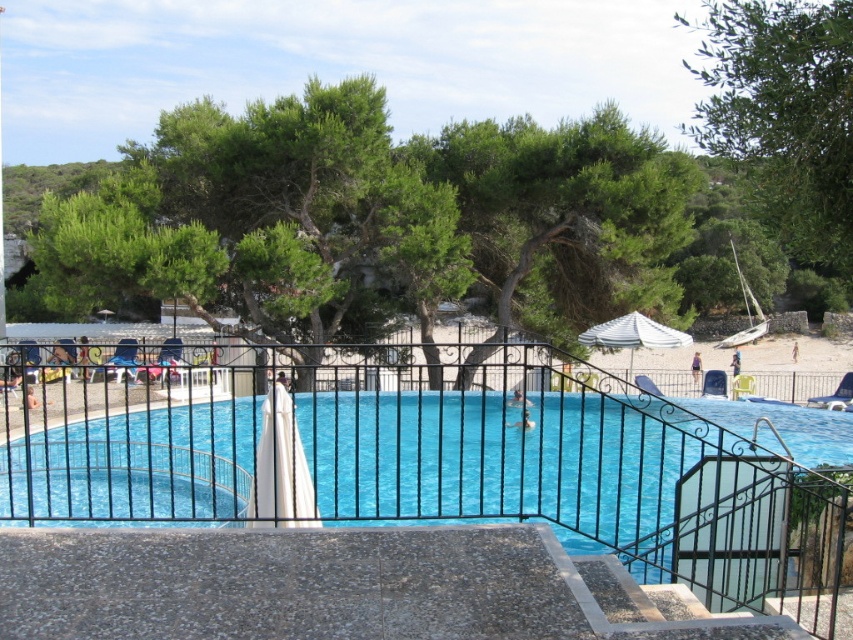
Does blue glossy water at center appear on the left side of green leafy tree at center?

No, blue glossy water at center is not to the left of green leafy tree at center.

Locate an element on the screen. This screenshot has width=853, height=640. blue glossy water at center is located at coordinates (567, 465).

Is point (817, 422) in front of point (369, 108)?

Yes, it is in front of point (369, 108).

Find the location of a particular element. This screenshot has height=640, width=853. blue glossy water at center is located at coordinates (567, 465).

What do you see at coordinates (265, 220) in the screenshot?
I see `green leafy tree at center` at bounding box center [265, 220].

Is point (215, 292) behind point (808, 163)?

That is True.

What do you see at coordinates (265, 220) in the screenshot? Image resolution: width=853 pixels, height=640 pixels. I see `green leafy tree at center` at bounding box center [265, 220].

Where is `green leafy tree at center`? The image size is (853, 640). green leafy tree at center is located at coordinates (265, 220).

Which of these two, blue glossy water at center or green leafy tree at upper right, stands taller?

green leafy tree at upper right is taller.

Locate an element on the screen. This screenshot has width=853, height=640. blue glossy water at center is located at coordinates (567, 465).